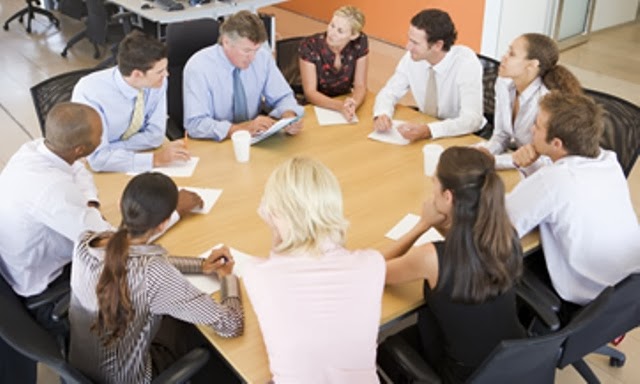
You are a GUI agent. You are given a task and a screenshot of the screen. Output one action in this format:
    pyautogui.click(x=<x>, y=<y>)
    Task: Click on the chairs
    
    Given the screenshot: What is the action you would take?
    pyautogui.click(x=66, y=87), pyautogui.click(x=185, y=48), pyautogui.click(x=11, y=330), pyautogui.click(x=43, y=295), pyautogui.click(x=525, y=366), pyautogui.click(x=600, y=323), pyautogui.click(x=620, y=116), pyautogui.click(x=486, y=66), pyautogui.click(x=105, y=22), pyautogui.click(x=38, y=19)